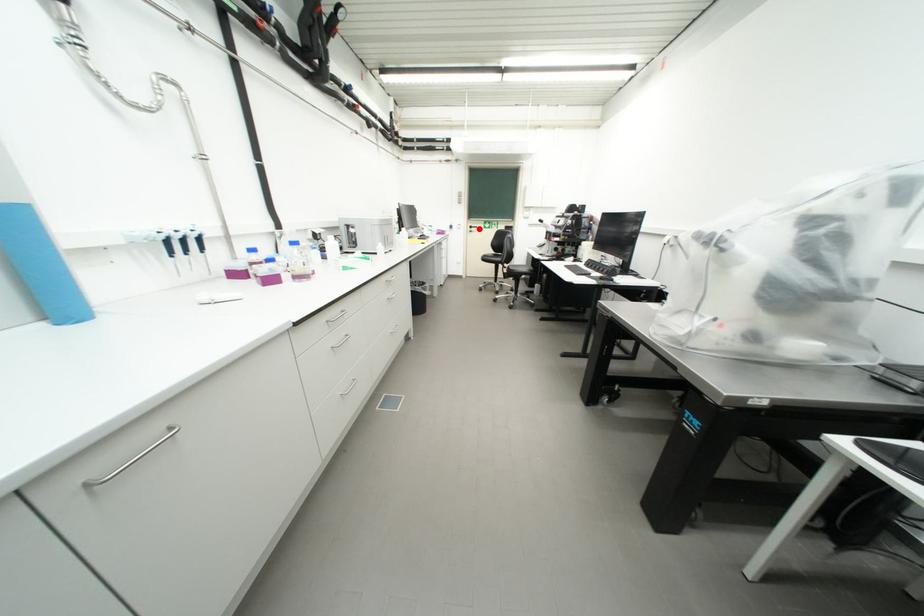
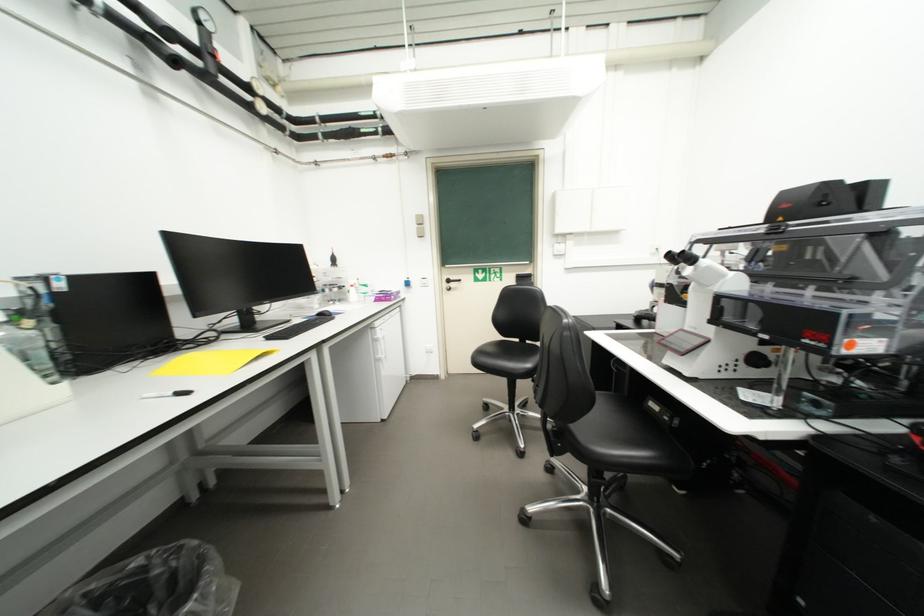
Locate, in the second image, the point that corresponds to the highlighted location in the first image.

(456, 283)